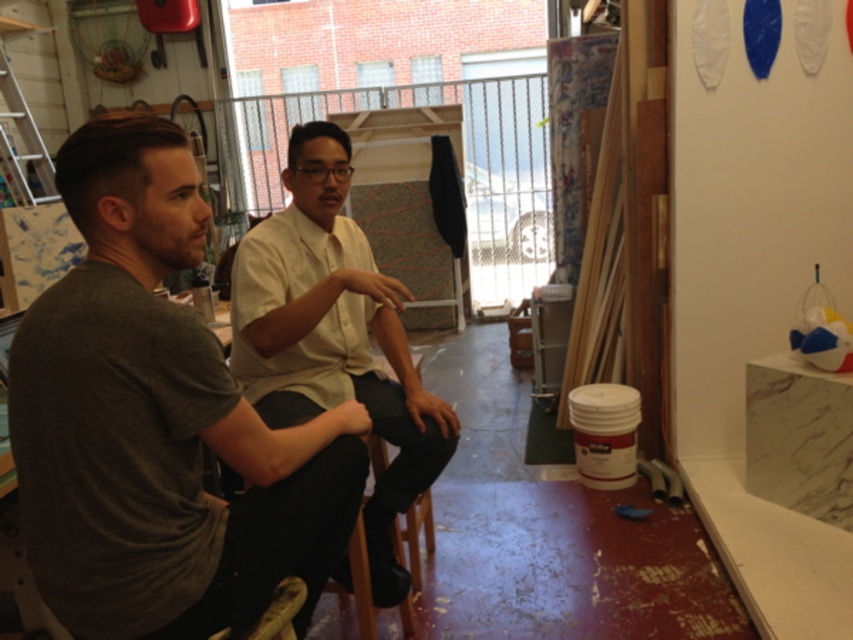
Identify the location of dark gray t-shirt at left. The width and height of the screenshot is (853, 640). (158, 420).

From the picture: Can you confirm if dark gray t-shirt at left is bigger than white matte shirt at center?

No, dark gray t-shirt at left is not bigger than white matte shirt at center.

Between point (113, 173) and point (397, 282), which one is positioned behind?

The point (397, 282) is behind.

Find the location of a particular element. dark gray t-shirt at left is located at coordinates (158, 420).

Which of these two, white matte shirt at center or brushed metal ladder at upper left, stands shorter?

Standing shorter between the two is brushed metal ladder at upper left.

Can you confirm if white matte shirt at center is bigger than brushed metal ladder at upper left?

No, white matte shirt at center is not bigger than brushed metal ladder at upper left.

Is point (363, 515) closer to viewer compared to point (0, 65)?

Yes, it is in front of point (0, 65).

You are a GUI agent. You are given a task and a screenshot of the screen. Output one action in this format:
    pyautogui.click(x=<x>, y=<y>)
    Task: Click on the white matte shirt at center
    
    Given the screenshot: What is the action you would take?
    pyautogui.click(x=334, y=337)

Identify the location of dark gray t-shirt at left. click(x=158, y=420).

Who is more forward, (343, 490) or (421, 516)?

Point (343, 490) is more forward.

What are the coordinates of `dark gray t-shirt at left` in the screenshot? It's located at (158, 420).